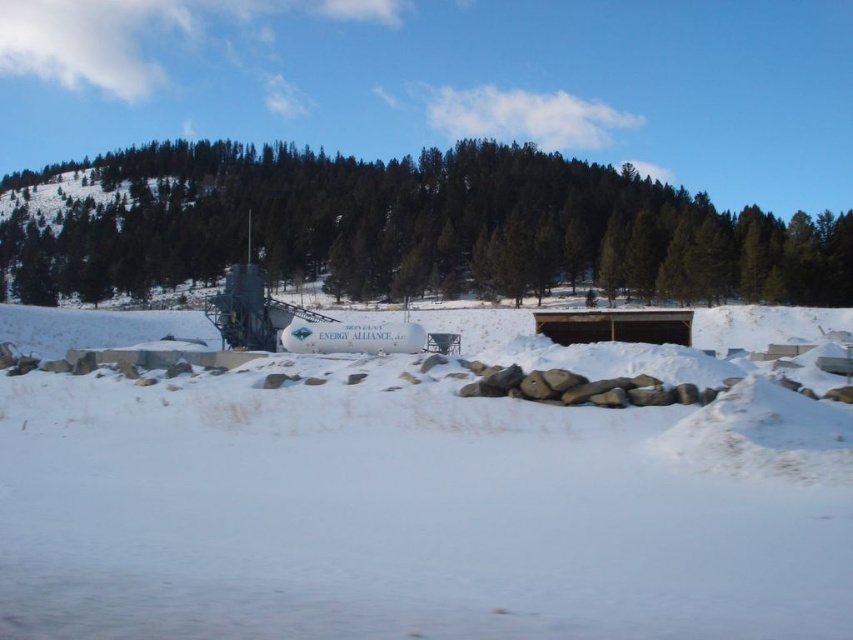
Question: Does white matte snow at center appear on the right side of green matte tree at upper center?

Choices:
 (A) yes
 (B) no

Answer: (A)

Question: Is white matte snow at center smaller than green matte tree at upper center?

Choices:
 (A) yes
 (B) no

Answer: (A)

Question: Can you confirm if white matte snow at center is wider than green matte tree at upper center?

Choices:
 (A) no
 (B) yes

Answer: (A)

Question: Which of the following is the farthest from the observer?

Choices:
 (A) green matte tree at upper center
 (B) white matte snow at center

Answer: (A)

Question: Which point is farther to the camera?

Choices:
 (A) green matte tree at upper center
 (B) white matte snow at center

Answer: (A)